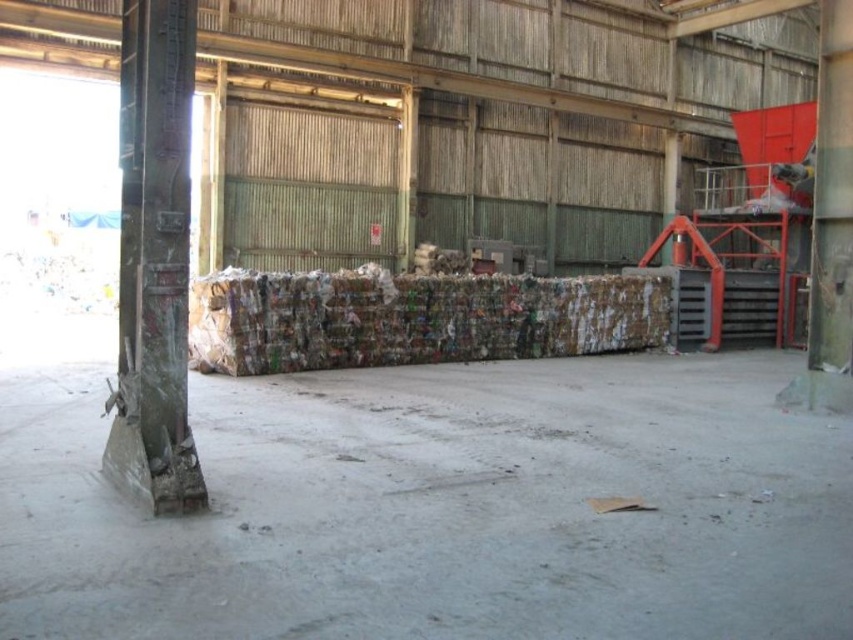
You are a forklift operator needing to move the brown cardboard bales at center and the concrete textured pillar at left. Which object should you move first if you want to move the smaller one first?

The concrete textured pillar at left is smaller than the brown cardboard bales at center, so you should move the concrete textured pillar at left first.

You are navigating a forklift in the recycling center and need to move from point A to point B. Point A is at coordinate point (149,230) and point B is at coordinate point (263,316). According to the scene description, which point is closer to the wall with the compacted materials?

Point (149,230) is closer to the wall with the compacted materials because point (263,316) is behind it.

You are navigating through the industrial facility and need to reach the control panel located at point 0.5, 0.5. Are the brown cardboard bales at center blocking your direct path to the control panel?

The brown cardboard bales at center are located at point (415, 317), which is very close to the control panel at (426, 320). Depending on the size of the bales, they might be directly in the way, but since the coordinates are nearly identical, it suggests they are positioned right at the target location, potentially blocking access.